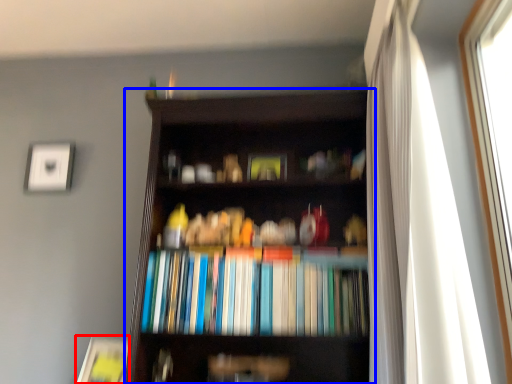
Question: Which of the following is the farthest to the observer, paperback book (highlighted by a red box) or bookcase (highlighted by a blue box)?

Choices:
 (A) paperback book
 (B) bookcase

Answer: (A)